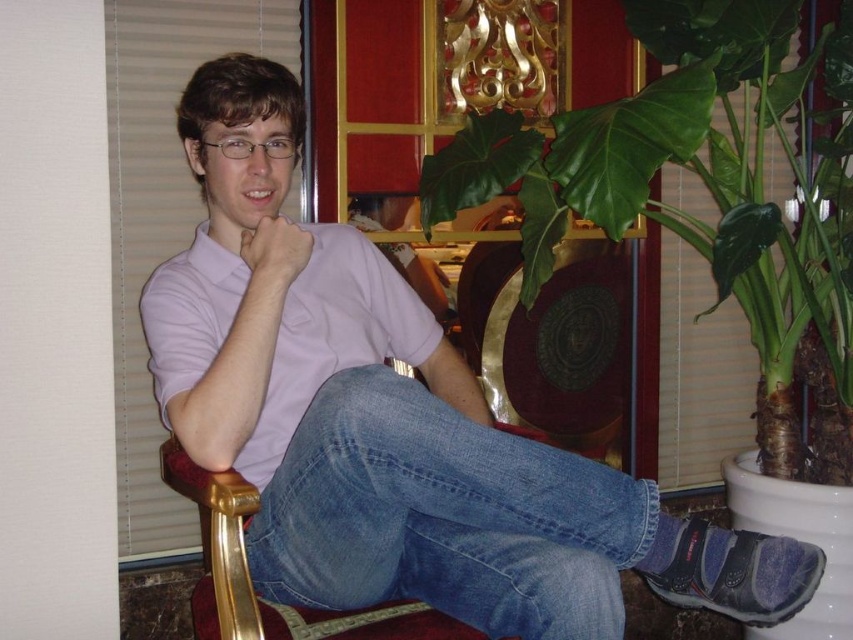
Question: Can you confirm if light purple shirt at center is wider than green leafy plant at right?

Choices:
 (A) no
 (B) yes

Answer: (A)

Question: Among these points, which one is farthest from the camera?

Choices:
 (A) (407, 563)
 (B) (302, 240)
 (C) (619, 228)
 (D) (791, 564)

Answer: (C)

Question: Is green leafy plant at right to the left of denim jeans at center from the viewer's perspective?

Choices:
 (A) yes
 (B) no

Answer: (B)

Question: Observing the image, what is the correct spatial positioning of green leafy plant at right in reference to denim jeans at center?

Choices:
 (A) left
 (B) right

Answer: (B)

Question: Which object appears closest to the camera in this image?

Choices:
 (A) green leafy plant at right
 (B) light purple shirt at center
 (C) matte skin hand at center

Answer: (B)

Question: Which object is closer to the camera taking this photo?

Choices:
 (A) matte skin hand at center
 (B) light purple shirt at center
 (C) green leafy plant at right
 (D) denim jeans at center

Answer: (D)